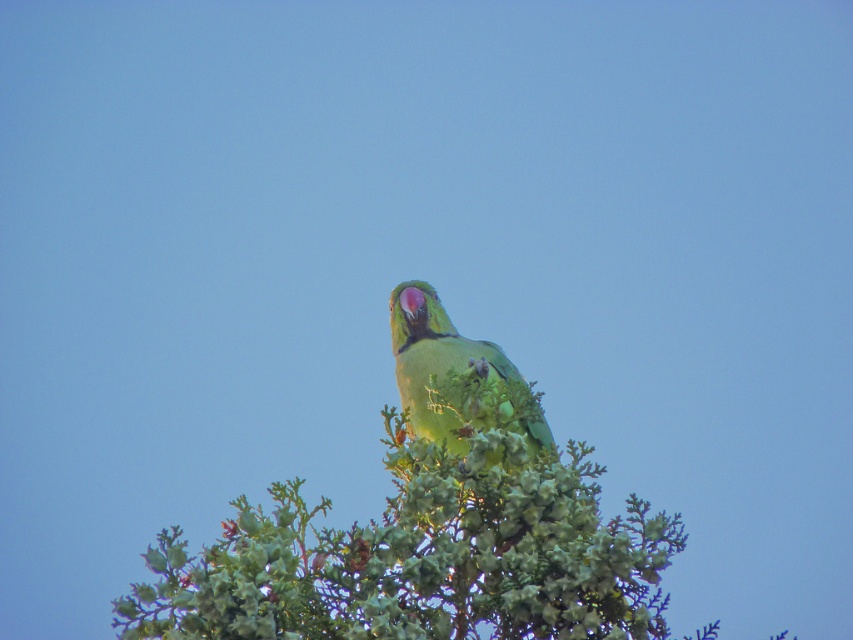
You are a birdwatcher observing the scene. You notice the green leafy tree at center and the green matte parrot at center. Which object is closer to the camera?

The green matte parrot at center is closer to the camera because the green leafy tree at center is positioned under it.

You are a birdwatcher trying to observe the green matte parrot at center. The green leafy tree at center is blocking your view. Can you determine which object is larger to decide if you need to move closer?

The green leafy tree at center is bigger than the green matte parrot at center, so you need to move closer to get a better view of the parrot.

You are a photographer trying to capture a clear shot of the green matte parrot at center. However, the green leafy tree at center is blocking your view. Can you adjust your position to get an unobstructed view of the parrot?

The green leafy tree at center is closer to the viewer than the green matte parrot at center, so moving your position to either side might allow you to see around the tree and get an unobstructed view of the parrot.